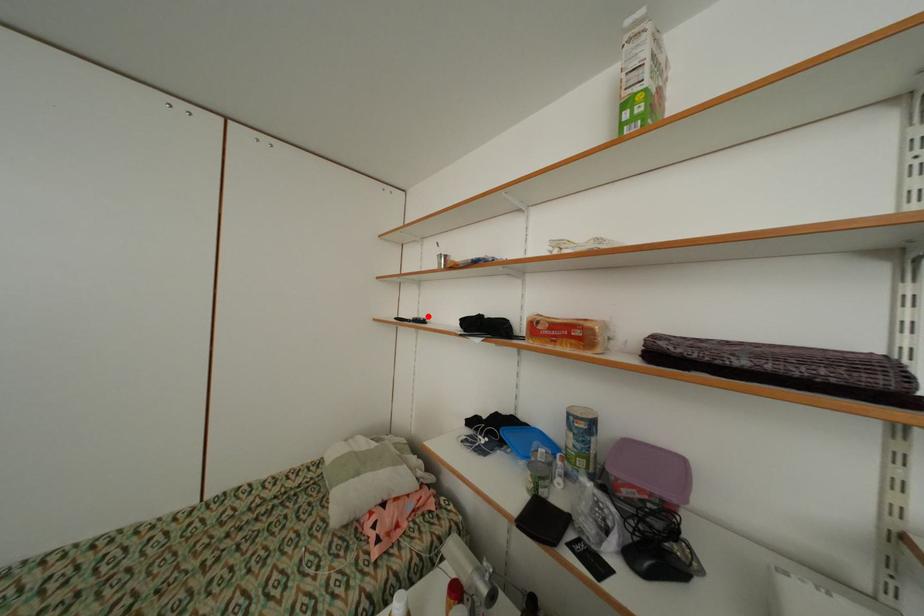
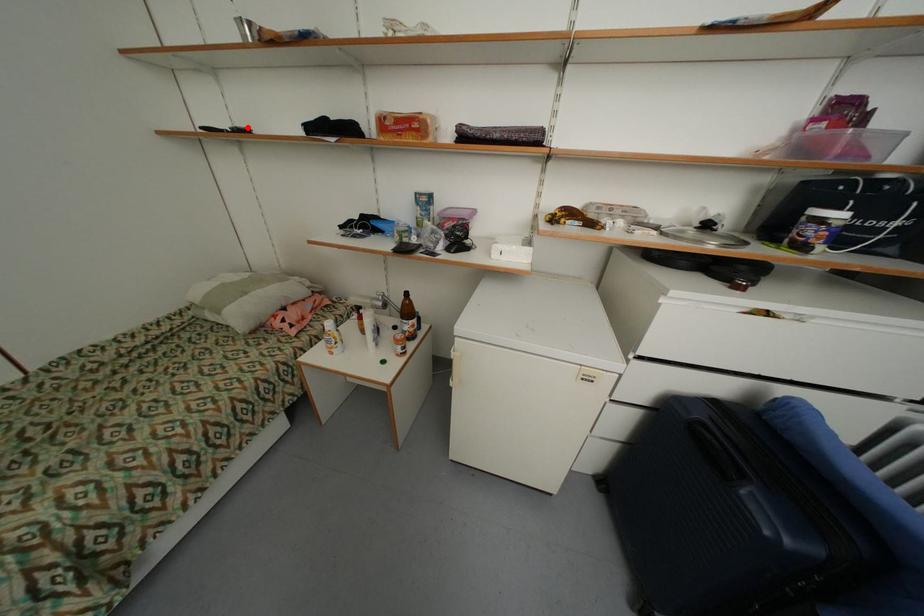
I am providing you with two images of the same scene from different viewpoints. A red point is marked on the first image and another point is marked on the second image. Is the marked point in image1 the same physical position as the marked point in image2?

Yes